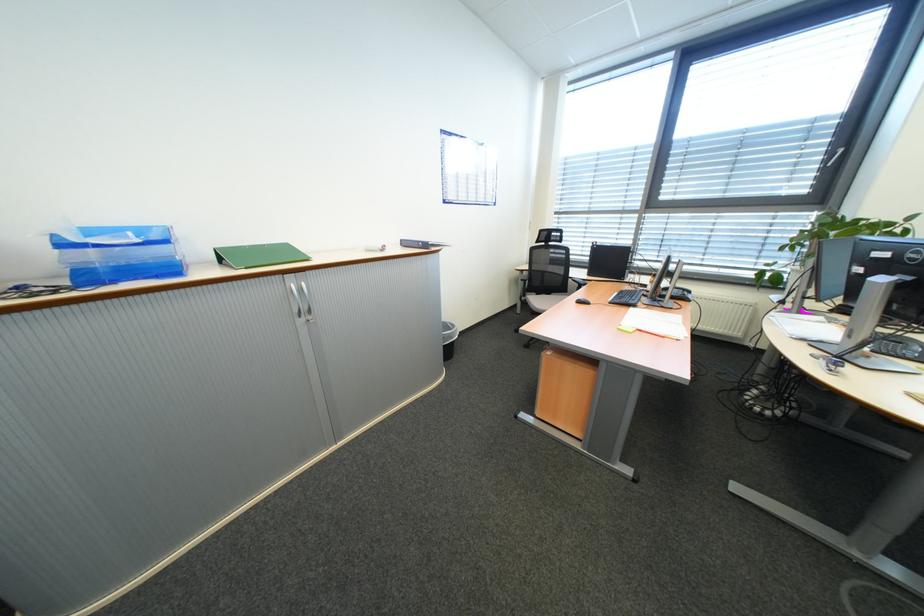
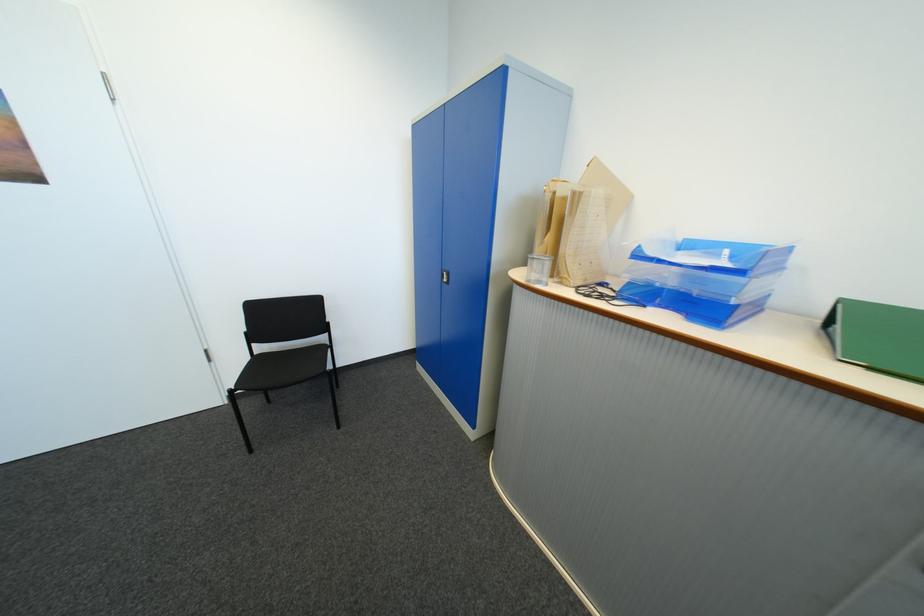
Where in the second image is the point corresponding to (x=107, y=246) from the first image?

(671, 262)